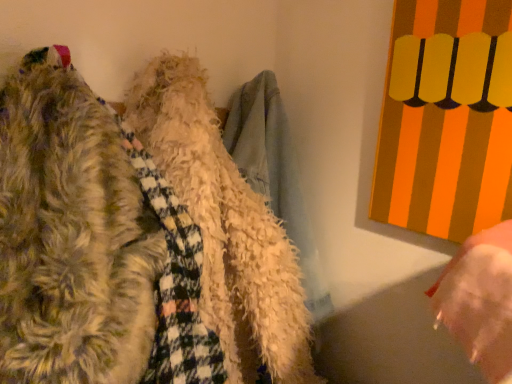
Describe the element at coordinates (136, 240) in the screenshot. Image resolution: width=512 pixels, height=384 pixels. I see `fuzzy white scarf at upper left` at that location.

What is the approximate width of fuzzy white scarf at upper left?

18.81 inches.

Identify the location of fuzzy white scarf at upper left. (136, 240).

The image size is (512, 384). I want to click on fuzzy white scarf at upper left, so click(136, 240).